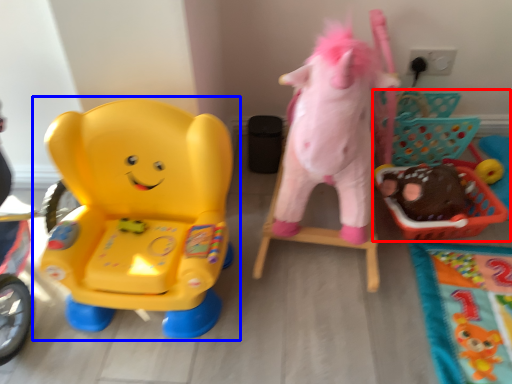
Question: Which object is further to the camera taking this photo, toy (highlighted by a red box) or toy (highlighted by a blue box)?

Choices:
 (A) toy
 (B) toy

Answer: (A)